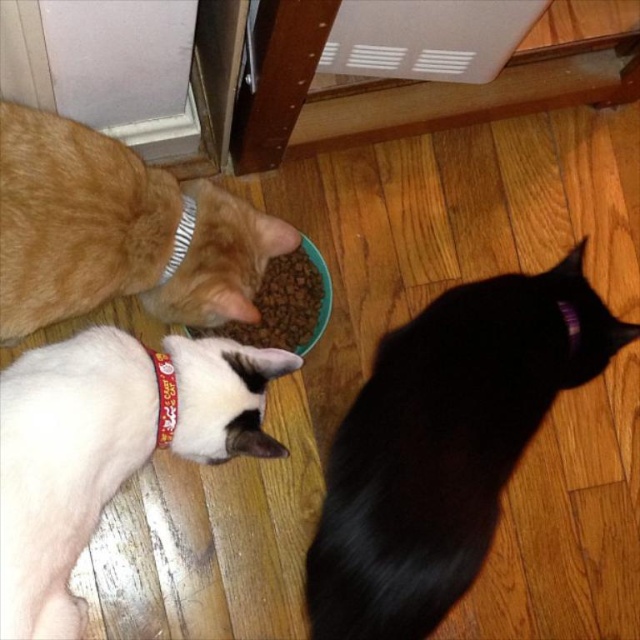
Question: Which object is farther from the camera taking this photo?

Choices:
 (A) dry kibble at center
 (B) white fur cat at lower left
 (C) orange fur cat at left

Answer: (A)

Question: Can you confirm if white fur cat at lower left is positioned above orange fur cat at left?

Choices:
 (A) yes
 (B) no

Answer: (B)

Question: Which object appears farthest from the camera in this image?

Choices:
 (A) orange fur cat at left
 (B) black silky cat at lower right
 (C) white fur cat at lower left

Answer: (B)

Question: Is black silky cat at lower right below dry kibble at center?

Choices:
 (A) yes
 (B) no

Answer: (A)

Question: Observing the image, what is the correct spatial positioning of black silky cat at lower right in reference to dry kibble at center?

Choices:
 (A) right
 (B) left

Answer: (A)

Question: Which of the following is the closest to the observer?

Choices:
 (A) (77, 282)
 (B) (312, 310)

Answer: (A)